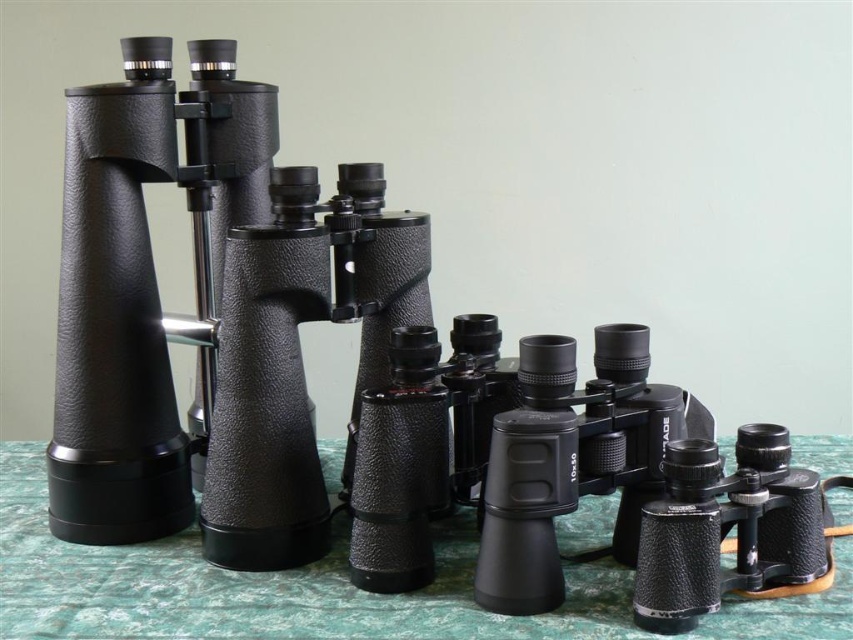
Who is more distant from viewer, (816, 444) or (306, 529)?

The point (816, 444) is more distant.

Based on the photo, does green textured tablecloth at center appear on the left side of matte black binoculars at center?

No, green textured tablecloth at center is not to the left of matte black binoculars at center.

Is point (614, 502) positioned before point (294, 451)?

That is False.

In order to click on green textured tablecloth at center in this screenshot , I will do `click(322, 589)`.